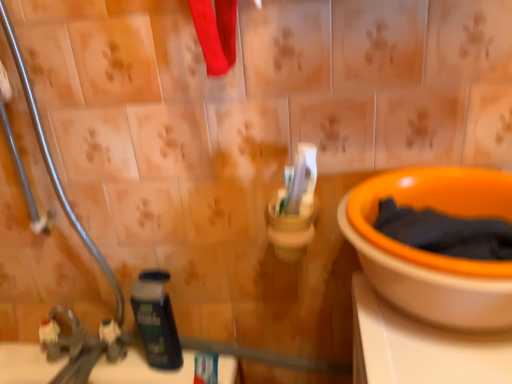
Question: Is brushed metal faucet at lower left positioned behind dark blue plastic shaving cream at lower left?

Choices:
 (A) no
 (B) yes

Answer: (A)

Question: Is brushed metal faucet at lower left wider than dark blue plastic shaving cream at lower left?

Choices:
 (A) no
 (B) yes

Answer: (B)

Question: Can you confirm if brushed metal faucet at lower left is bigger than dark blue plastic shaving cream at lower left?

Choices:
 (A) no
 (B) yes

Answer: (B)

Question: Is brushed metal faucet at lower left thinner than dark blue plastic shaving cream at lower left?

Choices:
 (A) yes
 (B) no

Answer: (B)

Question: Is brushed metal faucet at lower left oriented towards dark blue plastic shaving cream at lower left?

Choices:
 (A) yes
 (B) no

Answer: (B)

Question: Does brushed metal faucet at lower left appear on the right side of dark blue plastic shaving cream at lower left?

Choices:
 (A) no
 (B) yes

Answer: (A)

Question: Does brushed metal faucet at lower left appear on the left side of orange plastic bowl at right?

Choices:
 (A) no
 (B) yes

Answer: (B)

Question: Can you confirm if brushed metal faucet at lower left is shorter than orange plastic bowl at right?

Choices:
 (A) yes
 (B) no

Answer: (B)

Question: Is brushed metal faucet at lower left further to the viewer compared to orange plastic bowl at right?

Choices:
 (A) yes
 (B) no

Answer: (A)

Question: Does brushed metal faucet at lower left appear on the right side of orange plastic bowl at right?

Choices:
 (A) no
 (B) yes

Answer: (A)

Question: From the image's perspective, is brushed metal faucet at lower left located beneath orange plastic bowl at right?

Choices:
 (A) yes
 (B) no

Answer: (A)

Question: Does brushed metal faucet at lower left have a lesser width compared to orange plastic bowl at right?

Choices:
 (A) no
 (B) yes

Answer: (B)

Question: From the image's perspective, does orange plastic bowl at right appear higher than dark blue plastic shaving cream at lower left?

Choices:
 (A) yes
 (B) no

Answer: (A)